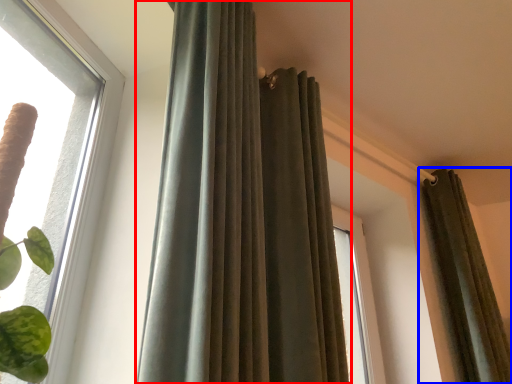
Question: Which point is closer to the camera, curtain (highlighted by a red box) or curtain (highlighted by a blue box)?

Choices:
 (A) curtain
 (B) curtain

Answer: (A)